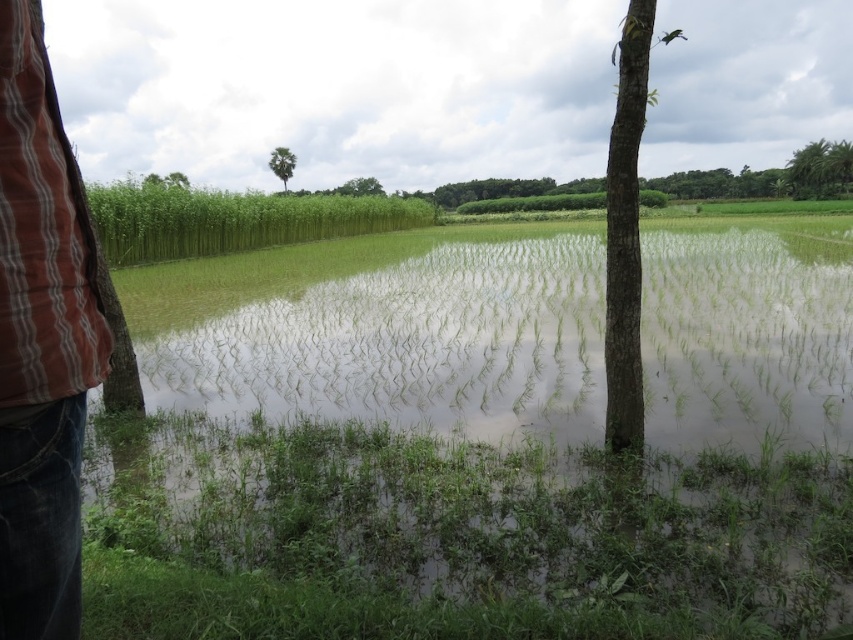
Question: Can you confirm if green leafy tree at upper right is positioned to the right of green leafy tree at upper left?

Choices:
 (A) yes
 (B) no

Answer: (A)

Question: Can you confirm if green leafy tree at upper center is positioned above green leafy tree at upper left?

Choices:
 (A) yes
 (B) no

Answer: (A)

Question: Which point appears closest to the camera in this image?

Choices:
 (A) pos(274,150)
 (B) pos(27,35)

Answer: (B)

Question: Estimate the real-world distances between objects in this image. Which object is closer to the smooth brown tree at right?

Choices:
 (A) green leafy tree at upper right
 (B) green leafy tree at upper center
 (C) jeans at left
 (D) green leafy tree at upper left

Answer: (C)

Question: Which object appears closest to the camera in this image?

Choices:
 (A) smooth brown tree at right
 (B) green leafy tree at upper right
 (C) jeans at left
 (D) green leafy tree at upper center

Answer: (C)

Question: Is smooth brown tree at right above green leafy tree at upper left?

Choices:
 (A) no
 (B) yes

Answer: (A)